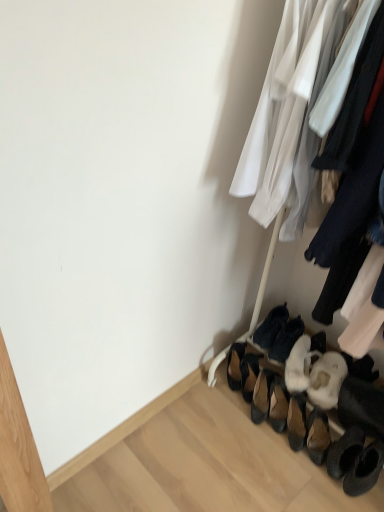
What is the approximate width of dark blue suede shoes at lower right, which is the third footwear in left-to-right order?

It is 10.42 inches.

At what (x,y) coordinates should I click in order to perform the action: click on leather/textured shoe at lower center, placed as the second footwear when sorted from left to right. Please return your answer as a coordinate pair (x, y). This screenshot has width=384, height=512. Looking at the image, I should click on (249, 374).

At what (x,y) coordinates should I click in order to perform the action: click on black suede heels at lower right, the first footwear when ordered from left to right. Please return your answer as a coordinate pair (x, y). Looking at the image, I should click on (235, 365).

Locate an element on the screen. dark blue suede shoes at lower right, the 1th footwear in the right-to-left sequence is located at coordinates (286, 340).

Identify the location of dark blue suede shoes at lower right, which is the third footwear in left-to-right order. The image size is (384, 512). (270, 327).

Considering the relative sizes of leather/textured shoe at lower center, which is the 3th footwear from right to left, and dark blue suede shoes at lower right, the fourth footwear from the left, in the image provided, is leather/textured shoe at lower center, which is the 3th footwear from right to left, smaller than dark blue suede shoes at lower right, the fourth footwear from the left,?

Correct, leather/textured shoe at lower center, which is the 3th footwear from right to left, occupies less space than dark blue suede shoes at lower right, the fourth footwear from the left.

In terms of height, does leather/textured shoe at lower center, placed as the second footwear when sorted from left to right, look taller or shorter compared to dark blue suede shoes at lower right, the 1th footwear in the right-to-left sequence?

Considering their sizes, leather/textured shoe at lower center, placed as the second footwear when sorted from left to right, has more height than dark blue suede shoes at lower right, the 1th footwear in the right-to-left sequence.

Can we say leather/textured shoe at lower center, which is the 3th footwear from right to left, lies outside dark blue suede shoes at lower right, the 1th footwear in the right-to-left sequence?

Yes, leather/textured shoe at lower center, which is the 3th footwear from right to left, is not within dark blue suede shoes at lower right, the 1th footwear in the right-to-left sequence.

Considering the points (245, 377) and (292, 320), which point is in front, point (245, 377) or point (292, 320)?

The point (245, 377) is in front.

In the image, is dark blue suede shoes at lower right, which is the second footwear in right-to-left order, on the left side or the right side of black suede heels at lower right, the first footwear when ordered from left to right?

Based on their positions, dark blue suede shoes at lower right, which is the second footwear in right-to-left order, is located to the right of black suede heels at lower right, the first footwear when ordered from left to right.

Which object is further away from the camera, dark blue suede shoes at lower right, which is the third footwear in left-to-right order, or black suede heels at lower right, the 4th footwear in the right-to-left sequence?

dark blue suede shoes at lower right, which is the third footwear in left-to-right order.

Considering the sizes of dark blue suede shoes at lower right, which is the third footwear in left-to-right order, and black suede heels at lower right, the first footwear when ordered from left to right, in the image, is dark blue suede shoes at lower right, which is the third footwear in left-to-right order, bigger or smaller than black suede heels at lower right, the first footwear when ordered from left to right,?

dark blue suede shoes at lower right, which is the third footwear in left-to-right order, is bigger than black suede heels at lower right, the first footwear when ordered from left to right.

Does dark blue suede shoes at lower right, which is the third footwear in left-to-right order, have a lesser width compared to black suede heels at lower right, the 4th footwear in the right-to-left sequence?

In fact, dark blue suede shoes at lower right, which is the third footwear in left-to-right order, might be wider than black suede heels at lower right, the 4th footwear in the right-to-left sequence.

Is leather/textured shoe at lower center, placed as the second footwear when sorted from left to right, behind dark blue suede shoes at lower right, which is the third footwear in left-to-right order?

No, leather/textured shoe at lower center, placed as the second footwear when sorted from left to right, is closer to the viewer.

Does leather/textured shoe at lower center, placed as the second footwear when sorted from left to right, appear on the right side of dark blue suede shoes at lower right, which is the second footwear in right-to-left order?

No.

Does leather/textured shoe at lower center, which is the 3th footwear from right to left, have a smaller size compared to dark blue suede shoes at lower right, which is the third footwear in left-to-right order?

Indeed, leather/textured shoe at lower center, which is the 3th footwear from right to left, has a smaller size compared to dark blue suede shoes at lower right, which is the third footwear in left-to-right order.

Looking at their sizes, would you say black suede heels at lower right, the 4th footwear in the right-to-left sequence, is wider or thinner than leather/textured shoe at lower center, placed as the second footwear when sorted from left to right?

Clearly, black suede heels at lower right, the 4th footwear in the right-to-left sequence, has more width compared to leather/textured shoe at lower center, placed as the second footwear when sorted from left to right.

Can we say black suede heels at lower right, the first footwear when ordered from left to right, lies outside leather/textured shoe at lower center, placed as the second footwear when sorted from left to right?

black suede heels at lower right, the first footwear when ordered from left to right, lies outside leather/textured shoe at lower center, placed as the second footwear when sorted from left to right,'s area.

Is black suede heels at lower right, the first footwear when ordered from left to right, oriented towards leather/textured shoe at lower center, placed as the second footwear when sorted from left to right?

No, black suede heels at lower right, the first footwear when ordered from left to right, is not oriented towards leather/textured shoe at lower center, placed as the second footwear when sorted from left to right.

Between black suede heels at lower right, the 4th footwear in the right-to-left sequence, and leather/textured shoe at lower center, placed as the second footwear when sorted from left to right, which one has more height?

black suede heels at lower right, the 4th footwear in the right-to-left sequence, is taller.

Is dark blue suede shoes at lower right, which is the second footwear in right-to-left order, looking in the opposite direction of dark blue suede shoes at lower right, the fourth footwear from the left?

No.

What's the angular difference between dark blue suede shoes at lower right, which is the second footwear in right-to-left order, and dark blue suede shoes at lower right, the 1th footwear in the right-to-left sequence,'s facing directions?

The angle between the facing direction of dark blue suede shoes at lower right, which is the second footwear in right-to-left order, and the facing direction of dark blue suede shoes at lower right, the 1th footwear in the right-to-left sequence, is 5.41 degrees.

From the image's perspective, between dark blue suede shoes at lower right, which is the second footwear in right-to-left order, and dark blue suede shoes at lower right, the fourth footwear from the left, which one is located above?

dark blue suede shoes at lower right, which is the second footwear in right-to-left order, is shown above in the image.

Can you confirm if dark blue suede shoes at lower right, which is the third footwear in left-to-right order, is wider than dark blue suede shoes at lower right, the 1th footwear in the right-to-left sequence?

Yes, dark blue suede shoes at lower right, which is the third footwear in left-to-right order, is wider than dark blue suede shoes at lower right, the 1th footwear in the right-to-left sequence.

From the image's perspective, which is below, dark blue suede shoes at lower right, which is the second footwear in right-to-left order, or leather/textured shoe at lower center, which is the 3th footwear from right to left?

leather/textured shoe at lower center, which is the 3th footwear from right to left, appears lower in the image.

Is dark blue suede shoes at lower right, which is the second footwear in right-to-left order, positioned behind leather/textured shoe at lower center, placed as the second footwear when sorted from left to right?

Yes, dark blue suede shoes at lower right, which is the second footwear in right-to-left order, is further from the camera.

Which is more to the right, dark blue suede shoes at lower right, which is the third footwear in left-to-right order, or leather/textured shoe at lower center, which is the 3th footwear from right to left?

dark blue suede shoes at lower right, which is the third footwear in left-to-right order, is more to the right.

Is dark blue suede shoes at lower right, which is the second footwear in right-to-left order, shorter than leather/textured shoe at lower center, placed as the second footwear when sorted from left to right?

Yes, dark blue suede shoes at lower right, which is the second footwear in right-to-left order, is shorter than leather/textured shoe at lower center, placed as the second footwear when sorted from left to right.

Which object is further away from the camera taking this photo, dark blue suede shoes at lower right, the 1th footwear in the right-to-left sequence, or dark blue suede shoes at lower right, which is the second footwear in right-to-left order?

dark blue suede shoes at lower right, which is the second footwear in right-to-left order, is behind.

Is dark blue suede shoes at lower right, the fourth footwear from the left, directly adjacent to dark blue suede shoes at lower right, which is the second footwear in right-to-left order?

Indeed, dark blue suede shoes at lower right, the fourth footwear from the left, and dark blue suede shoes at lower right, which is the second footwear in right-to-left order, are beside each other and touching.

Between point (287, 345) and point (281, 320), which one is positioned behind?

The point (281, 320) is behind.

From a real-world perspective, starting from the dark blue suede shoes at lower right, the fourth footwear from the left, which footwear is the 1st one below it? Please provide its 2D coordinates.

[(270, 327)]

The height and width of the screenshot is (512, 384). What are the coordinates of `footwear that is the 2nd one above the leather/textured shoe at lower center, placed as the second footwear when sorted from left to right (from a real-world perspective)` in the screenshot? It's located at (286, 340).

Locate an element on the screen. Image resolution: width=384 pixels, height=512 pixels. the 2nd footwear to the right of the black suede heels at lower right, the 4th footwear in the right-to-left sequence, starting your count from the anchor is located at coordinates (270, 327).

Based on the photo, considering their positions, is black suede heels at lower right, the 4th footwear in the right-to-left sequence, positioned closer to dark blue suede shoes at lower right, which is the second footwear in right-to-left order, than leather/textured shoe at lower center, which is the 3th footwear from right to left?

Based on the image, leather/textured shoe at lower center, which is the 3th footwear from right to left, appears to be nearer to dark blue suede shoes at lower right, which is the second footwear in right-to-left order.

Considering their positions, is black suede heels at lower right, the 4th footwear in the right-to-left sequence, positioned closer to dark blue suede shoes at lower right, the 1th footwear in the right-to-left sequence, than dark blue suede shoes at lower right, which is the second footwear in right-to-left order?

dark blue suede shoes at lower right, which is the second footwear in right-to-left order, lies closer to dark blue suede shoes at lower right, the 1th footwear in the right-to-left sequence, than the other object.

From the image, which object appears to be farther from black suede heels at lower right, the 4th footwear in the right-to-left sequence, dark blue suede shoes at lower right, which is the third footwear in left-to-right order, or leather/textured shoe at lower center, placed as the second footwear when sorted from left to right?

The object further to black suede heels at lower right, the 4th footwear in the right-to-left sequence, is dark blue suede shoes at lower right, which is the third footwear in left-to-right order.

Which object lies further to the anchor point dark blue suede shoes at lower right, the fourth footwear from the left, dark blue suede shoes at lower right, which is the second footwear in right-to-left order, or leather/textured shoe at lower center, which is the 3th footwear from right to left?

leather/textured shoe at lower center, which is the 3th footwear from right to left, is further to dark blue suede shoes at lower right, the fourth footwear from the left.

Based on their spatial positions, is dark blue suede shoes at lower right, which is the third footwear in left-to-right order, or dark blue suede shoes at lower right, the fourth footwear from the left, closer to leather/textured shoe at lower center, placed as the second footwear when sorted from left to right?

dark blue suede shoes at lower right, which is the third footwear in left-to-right order.

Considering their positions, is leather/textured shoe at lower center, which is the 3th footwear from right to left, positioned closer to dark blue suede shoes at lower right, which is the second footwear in right-to-left order, than dark blue suede shoes at lower right, the fourth footwear from the left?

dark blue suede shoes at lower right, the fourth footwear from the left, lies closer to dark blue suede shoes at lower right, which is the second footwear in right-to-left order, than the other object.

Looking at the image, which one is located closer to leather/textured shoe at lower center, which is the 3th footwear from right to left, dark blue suede shoes at lower right, the fourth footwear from the left, or black suede heels at lower right, the 4th footwear in the right-to-left sequence?

Based on the image, black suede heels at lower right, the 4th footwear in the right-to-left sequence, appears to be nearer to leather/textured shoe at lower center, which is the 3th footwear from right to left.

From the image, which object appears to be farther from leather/textured shoe at lower center, which is the 3th footwear from right to left, dark blue suede shoes at lower right, the fourth footwear from the left, or dark blue suede shoes at lower right, which is the second footwear in right-to-left order?

Among the two, dark blue suede shoes at lower right, the fourth footwear from the left, is located further to leather/textured shoe at lower center, which is the 3th footwear from right to left.